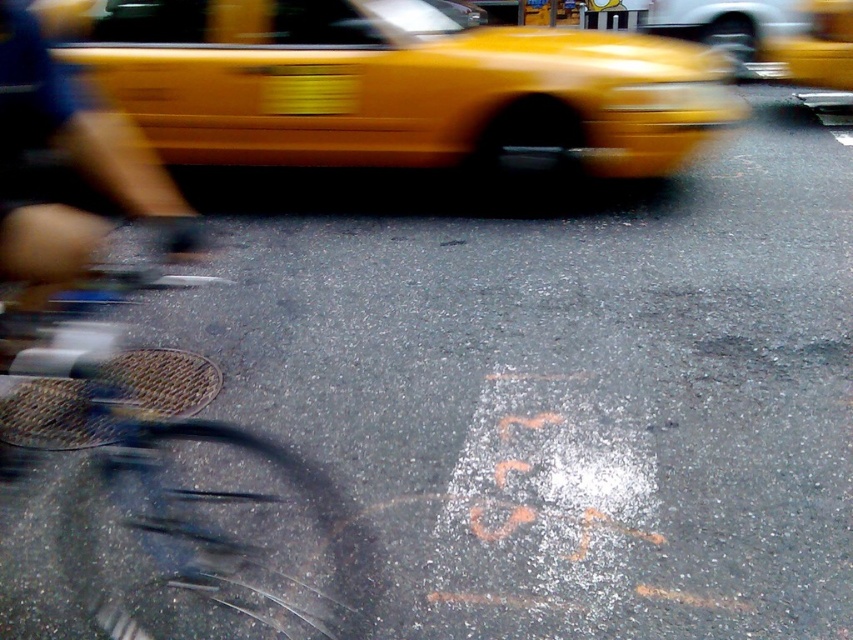
Question: Which point is closer to the camera?

Choices:
 (A) yellow plastic taxi at upper center
 (B) yellow rubber taxi at upper right

Answer: (A)

Question: Can you confirm if yellow plastic taxi at upper center is positioned to the left of blue metallic bicycle at lower left?

Choices:
 (A) yes
 (B) no

Answer: (B)

Question: Where is yellow plastic taxi at upper center located in relation to blue metallic bicycle at lower left in the image?

Choices:
 (A) above
 (B) below

Answer: (A)

Question: Which object is the closest to the yellow rubber taxi at upper right?

Choices:
 (A) blue metallic bicycle at lower left
 (B) yellow plastic taxi at upper center

Answer: (B)

Question: Which object is positioned closest to the yellow plastic taxi at upper center?

Choices:
 (A) yellow rubber taxi at upper right
 (B) blue metallic bicycle at lower left

Answer: (B)

Question: Is yellow plastic taxi at upper center positioned behind blue metallic bicycle at lower left?

Choices:
 (A) yes
 (B) no

Answer: (A)